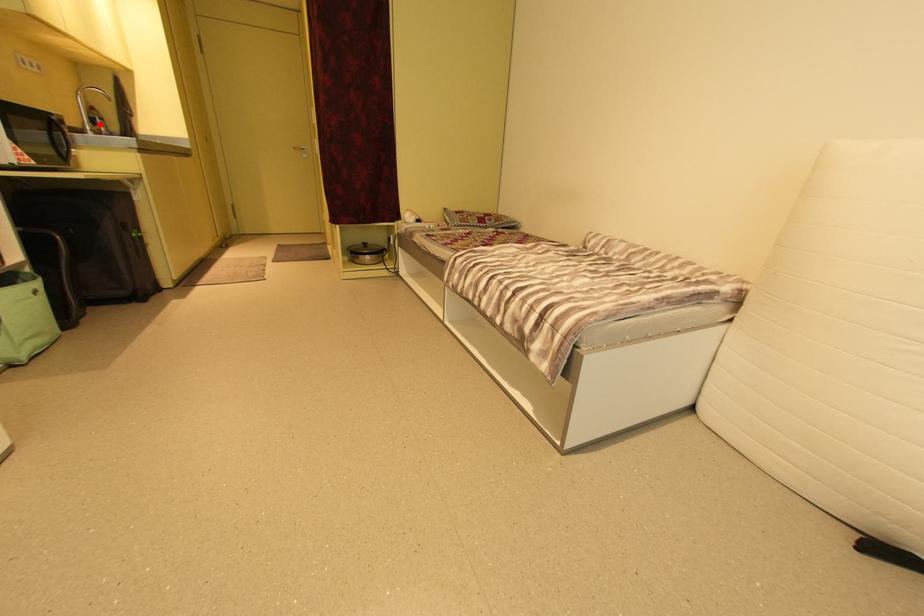
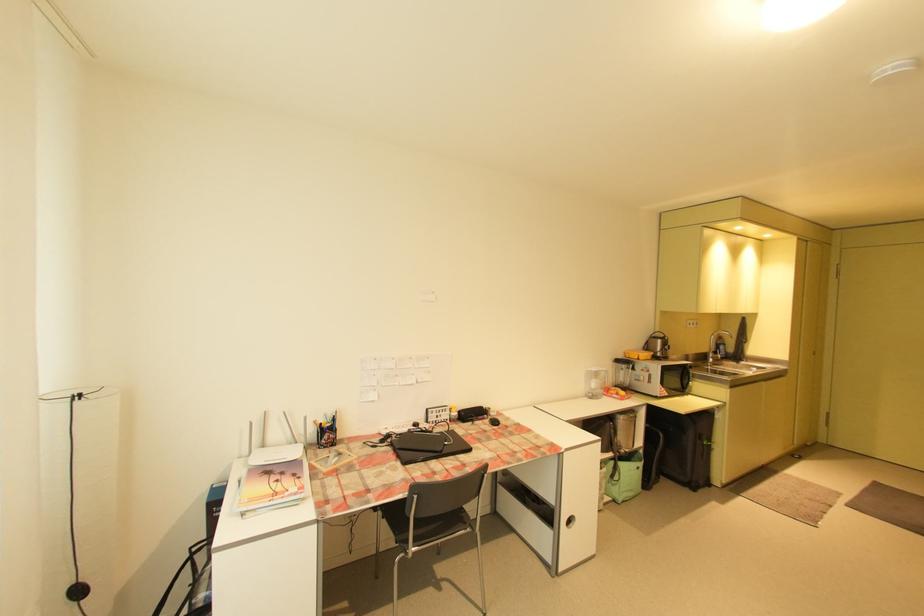
Question: I am providing you with two images of the same scene from different viewpoints. A red point is shown in image1. For the corresponding object point in image2, is it positioned nearer or farther from the camera?

Choices:
 (A) Nearer
 (B) Farther

Answer: (A)